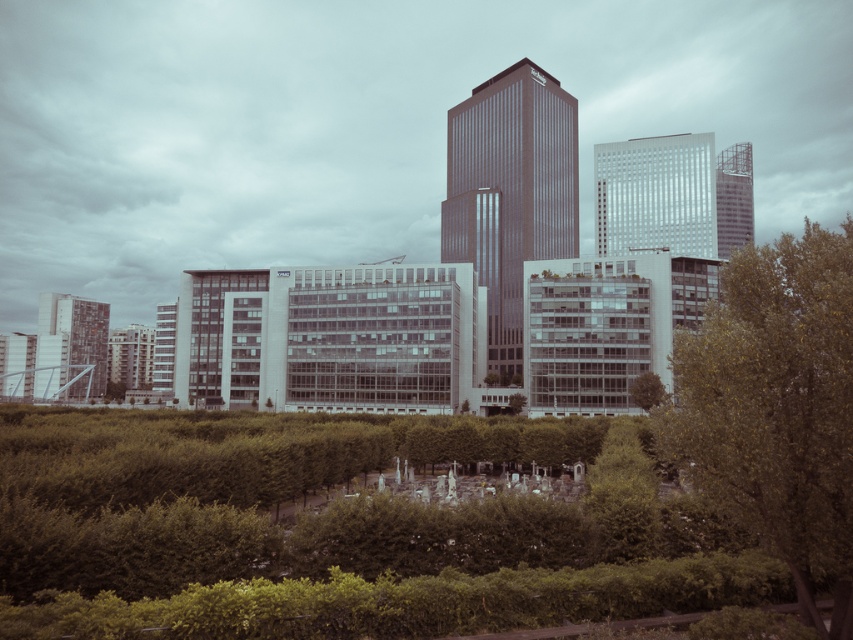
Who is positioned more to the right, green leafy tree at center or smooth glass skyscraper at center?

green leafy tree at center

Can you confirm if green leafy tree at center is positioned above smooth glass skyscraper at center?

Incorrect, green leafy tree at center is not positioned above smooth glass skyscraper at center.

Is point (753, 296) farther from camera compared to point (486, 276)?

No, it is in front of (486, 276).

Find the location of a particular element. This screenshot has height=640, width=853. green leafy tree at center is located at coordinates (775, 406).

Which of these two, white glass building at center or glassy reflective skyscraper at upper right, stands shorter?

Standing shorter between the two is white glass building at center.

Identify the location of white glass building at center. (654, 195).

At what (x,y) coordinates should I click in order to perform the action: click on white glass building at center. Please return your answer as a coordinate pair (x, y). Looking at the image, I should click on (654, 195).

Can you confirm if green leafy tree at center is thinner than matte gray building at lower left?

In fact, green leafy tree at center might be wider than matte gray building at lower left.

Looking at this image, is green leafy tree at center to the left of matte gray building at lower left from the viewer's perspective?

Incorrect, green leafy tree at center is not on the left side of matte gray building at lower left.

Is point (840, 592) closer to viewer compared to point (50, 364)?

Yes, point (840, 592) is in front of point (50, 364).

Locate an element on the screen. Image resolution: width=853 pixels, height=640 pixels. green leafy tree at center is located at coordinates (775, 406).